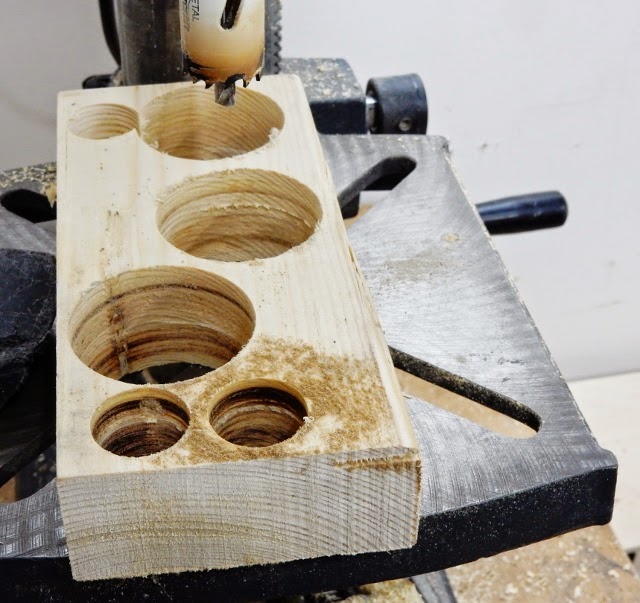
Locate an element on the screen. white wall is located at coordinates (515, 77).